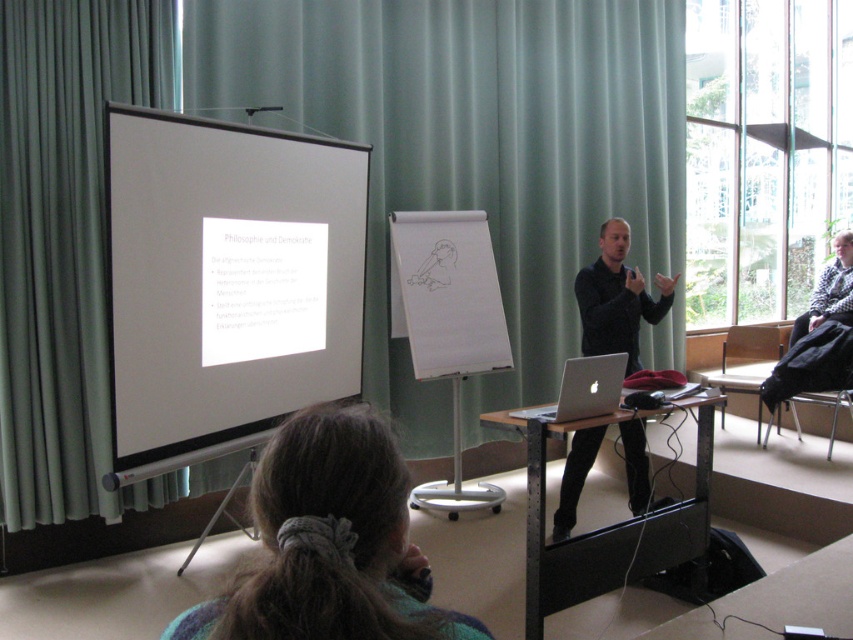
You are standing in the classroom and want to locate the white glossy projection screen at upper left. Can you tell me its coordinates in the image?

The white glossy projection screen at upper left is located at point coordinates of (225,284).

You are a student in the classroom and you want to describe the person at the desk in the flip chart. Which object has a smaller size between dark brown hair at lower center and black matte shirt at center?

The dark brown hair at lower center has a smaller size compared to the black matte shirt at center.